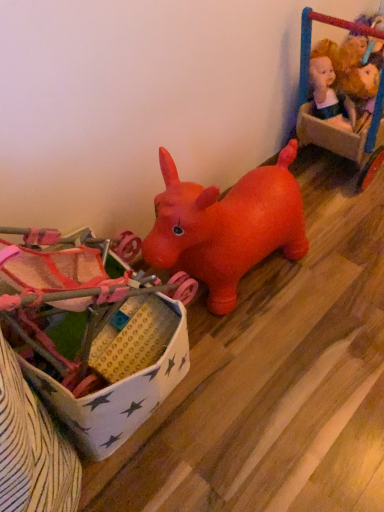
Question: From the image's perspective, does velvet plush doll at upper right, the 1th toy viewed from the top, appear higher than plush yellow doll at upper right, which is the 2th toy from top to bottom?

Choices:
 (A) no
 (B) yes

Answer: (B)

Question: From a real-world perspective, is velvet plush doll at upper right, the 3th toy ordered from the bottom, under plush yellow doll at upper right, placed as the second toy when sorted from bottom to top?

Choices:
 (A) no
 (B) yes

Answer: (A)

Question: Is the position of velvet plush doll at upper right, acting as the 1th toy starting from the right, more distant than that of plush yellow doll at upper right, placed as the second toy when sorted from bottom to top?

Choices:
 (A) no
 (B) yes

Answer: (A)

Question: Is velvet plush doll at upper right, the 1th toy viewed from the top, next to plush yellow doll at upper right, which ranks as the 2th toy in right-to-left order?

Choices:
 (A) yes
 (B) no

Answer: (B)

Question: Can we say velvet plush doll at upper right, the third toy positioned from the left, lies outside plush yellow doll at upper right, which ranks as the 2th toy in right-to-left order?

Choices:
 (A) no
 (B) yes

Answer: (B)

Question: Is velvet plush doll at upper right, the third toy positioned from the left, bigger than plush yellow doll at upper right, which ranks as the 2th toy in right-to-left order?

Choices:
 (A) yes
 (B) no

Answer: (A)

Question: Considering the relative sizes of velvet plush doll at upper right, acting as the 1th toy starting from the right, and matte plastic toy at center, marked as the first toy in a left-to-right arrangement, in the image provided, is velvet plush doll at upper right, acting as the 1th toy starting from the right, smaller than matte plastic toy at center, marked as the first toy in a left-to-right arrangement,?

Choices:
 (A) yes
 (B) no

Answer: (B)

Question: From the image's perspective, is velvet plush doll at upper right, the 1th toy viewed from the top, under matte plastic toy at center, which is the 1th toy from bottom to top?

Choices:
 (A) no
 (B) yes

Answer: (A)

Question: Can you confirm if velvet plush doll at upper right, the 1th toy viewed from the top, is shorter than matte plastic toy at center, which is the 1th toy from bottom to top?

Choices:
 (A) no
 (B) yes

Answer: (A)

Question: From the image's perspective, does velvet plush doll at upper right, acting as the 1th toy starting from the right, appear higher than matte plastic toy at center, which is the 1th toy from bottom to top?

Choices:
 (A) no
 (B) yes

Answer: (B)

Question: Is the depth of velvet plush doll at upper right, the 1th toy viewed from the top, greater than that of matte plastic toy at center, the 3th toy when ordered from top to bottom?

Choices:
 (A) no
 (B) yes

Answer: (B)

Question: Is velvet plush doll at upper right, the 1th toy viewed from the top, oriented towards matte plastic toy at center, the third toy in the right-to-left sequence?

Choices:
 (A) no
 (B) yes

Answer: (A)

Question: From a real-world perspective, is plush yellow doll at upper right, placed as the second toy when sorted from bottom to top, on top of velvet plush doll at upper right, acting as the 1th toy starting from the right?

Choices:
 (A) yes
 (B) no

Answer: (B)